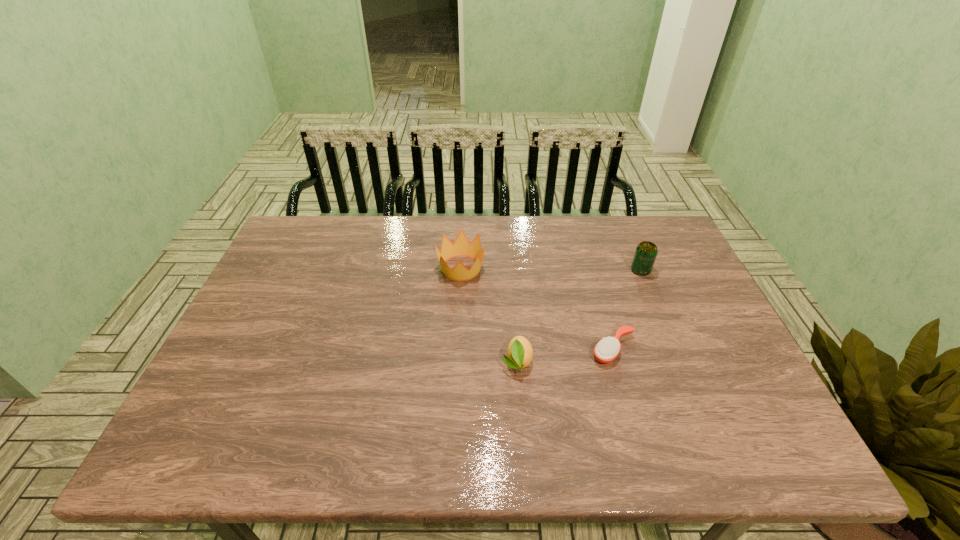
Where is `object located at the far edge`? The height and width of the screenshot is (540, 960). object located at the far edge is located at coordinates (461, 247).

This screenshot has height=540, width=960. I want to click on object at the right edge, so click(646, 252).

I want to click on vacant space at the far edge, so click(x=396, y=219).

Identify the location of free space at the near edge. click(494, 449).

The image size is (960, 540). In the image, there is a desktop. In order to click on free space at the left edge in this screenshot , I will do `click(247, 336)`.

Locate an element on the screen. This screenshot has height=540, width=960. free space at the right edge of the desktop is located at coordinates (695, 340).

The image size is (960, 540). In the image, there is a desktop. Find the location of `free region at the far right corner`. free region at the far right corner is located at coordinates (643, 233).

At what (x,y) coordinates should I click in order to perform the action: click on vacant point located between the beer can and the crown. Please return your answer as a coordinate pair (x, y). This screenshot has width=960, height=540. Looking at the image, I should click on (551, 269).

Find the location of a particular element. The height and width of the screenshot is (540, 960). vacant space that is in between the third object from left to right and the beer can is located at coordinates (627, 310).

The height and width of the screenshot is (540, 960). What are the coordinates of `empty location between the shortest object and the leftmost object` in the screenshot? It's located at (538, 309).